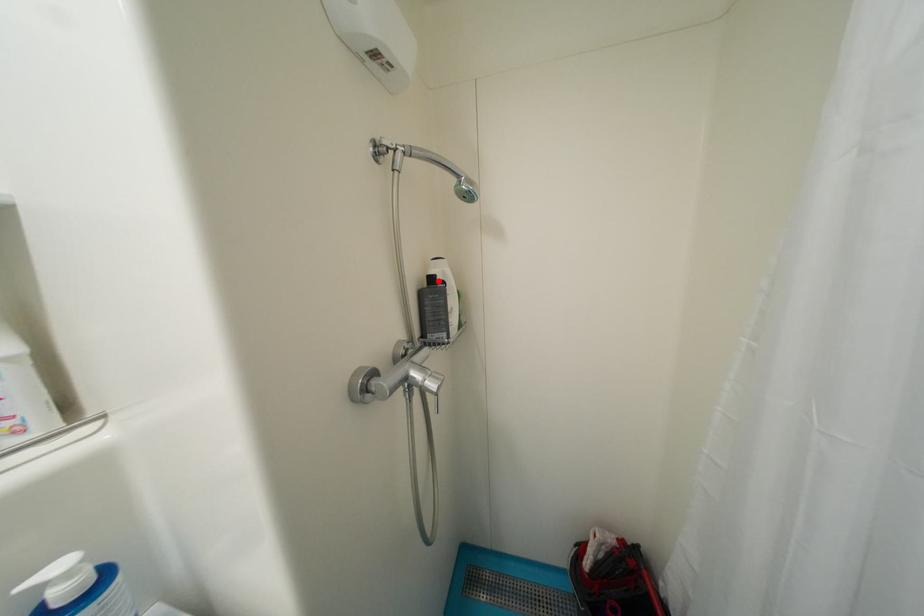
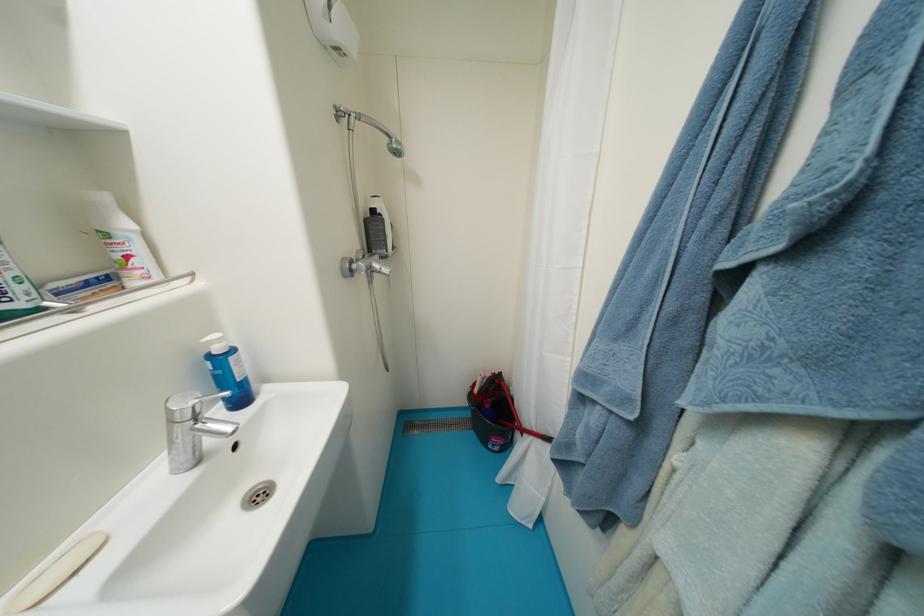
Locate, in the second image, the point that corresponds to the highlighted location in the first image.

(380, 214)